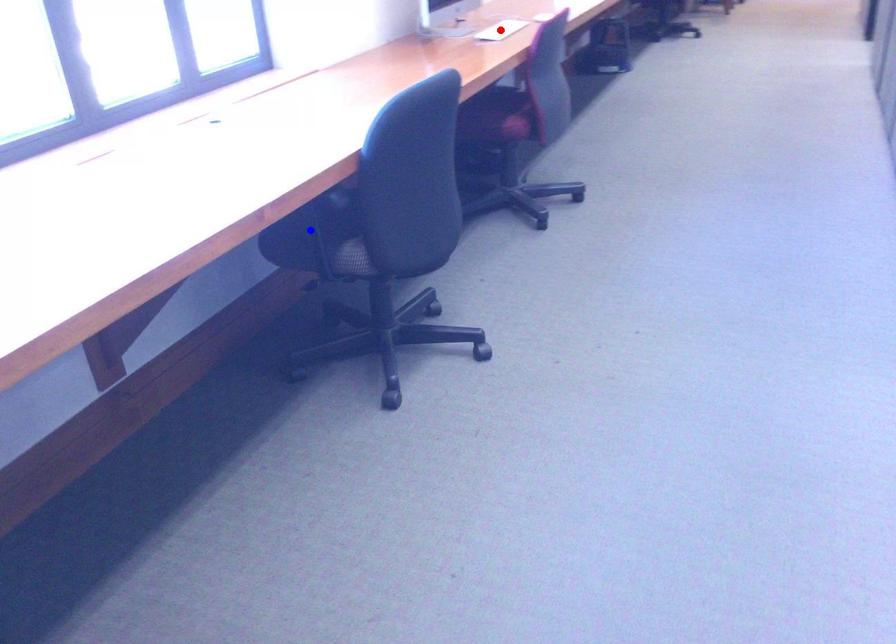
Question: Two points are marked on the image. Which point is closer to the camera?

Choices:
 (A) Blue point is closer.
 (B) Red point is closer.

Answer: (A)